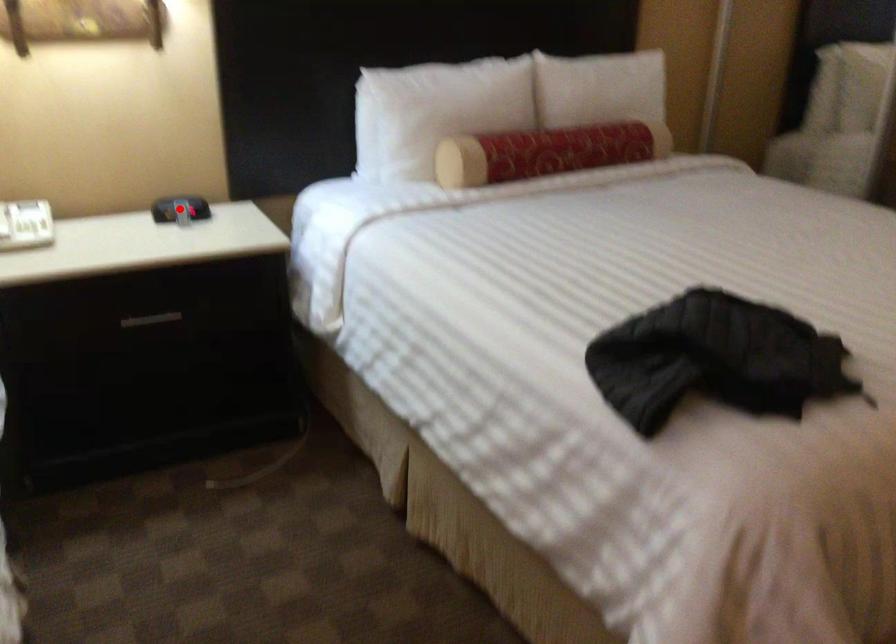
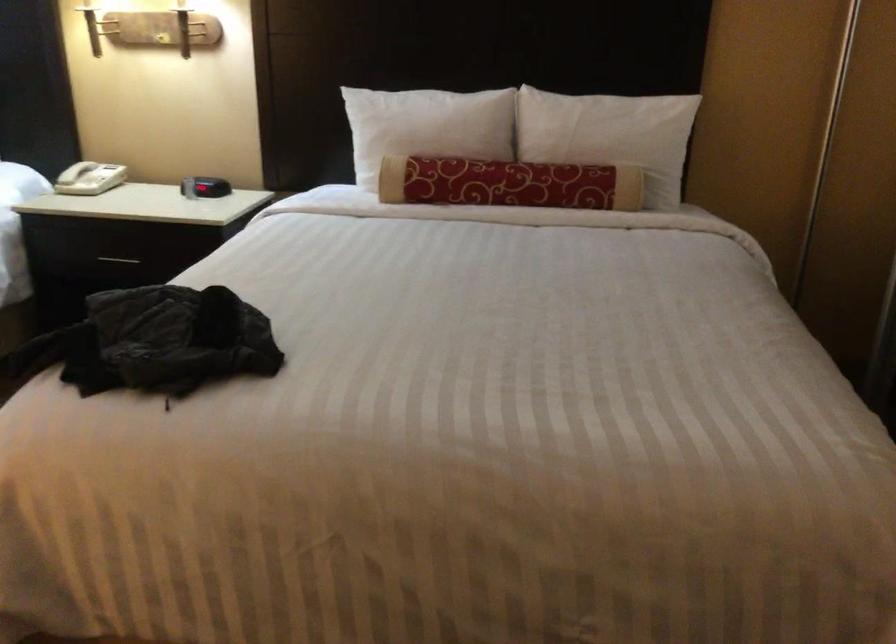
The point at the highlighted location is marked in the first image. Where is the corresponding point in the second image?

(177, 178)